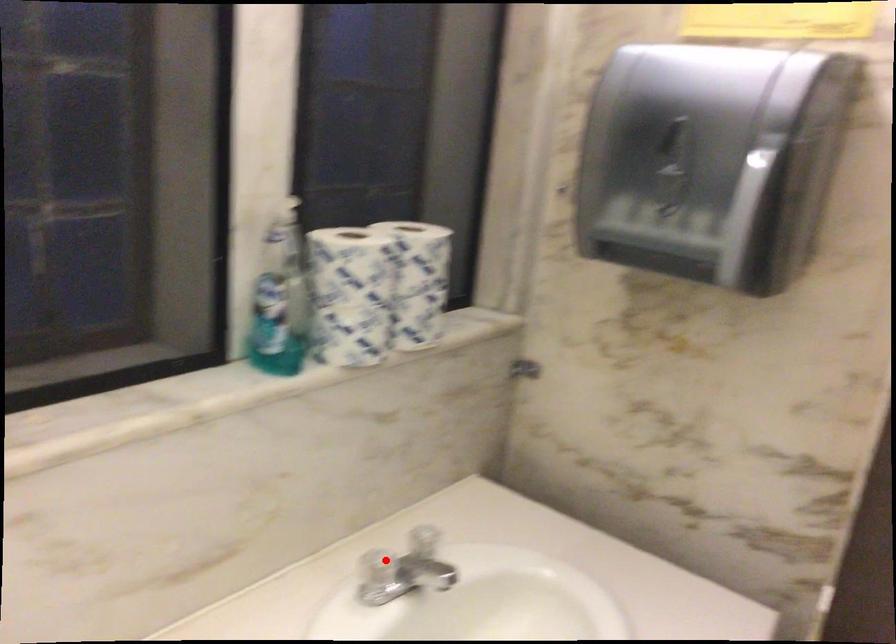
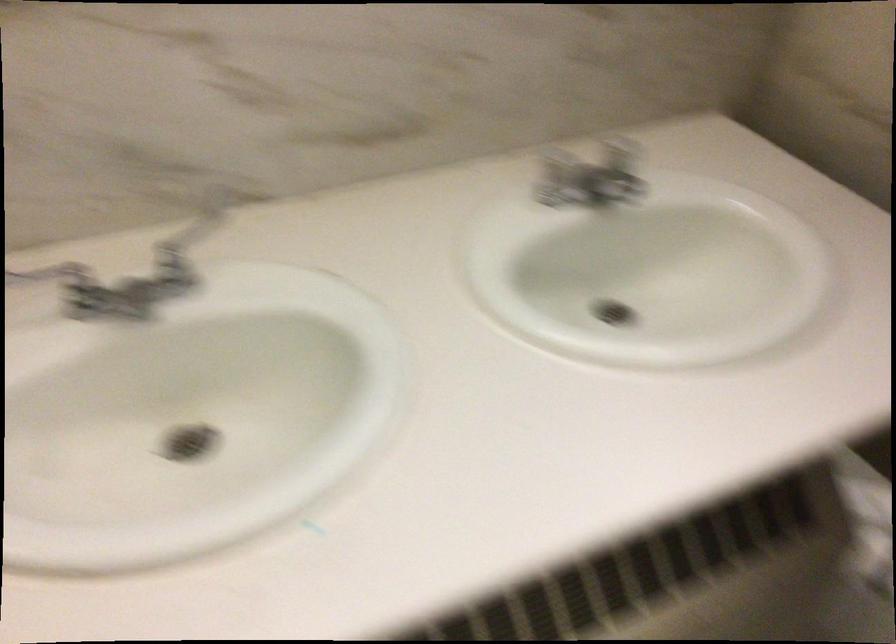
In the second image, find the point that corresponds to the highlighted location in the first image.

(554, 158)